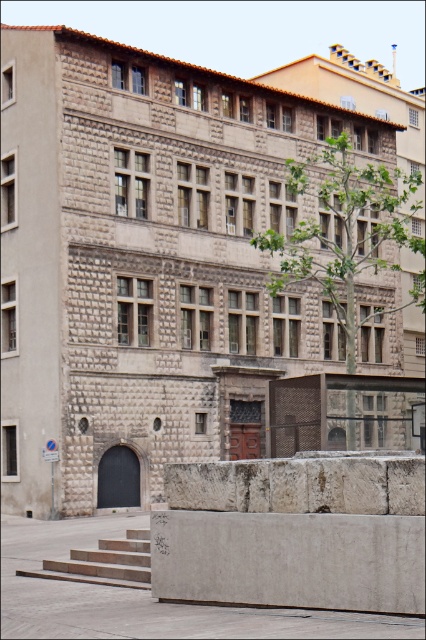
This screenshot has width=426, height=640. Describe the element at coordinates (345, 232) in the screenshot. I see `green leafy tree at center` at that location.

Looking at this image, does green leafy tree at center have a greater width compared to concrete steps at lower left?

Yes.

Does point (411, 180) come closer to viewer compared to point (55, 577)?

No, (411, 180) is further to viewer.

You are a GUI agent. You are given a task and a screenshot of the screen. Output one action in this format:
    pyautogui.click(x=<x>, y=<y>)
    Task: Click on the green leafy tree at center
    The image size is (426, 640).
    Given the screenshot: What is the action you would take?
    pyautogui.click(x=345, y=232)